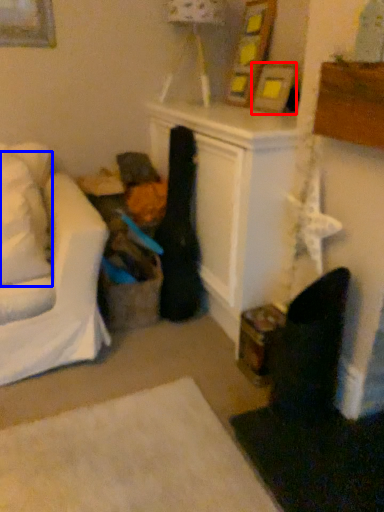
Question: Which object appears farthest to the camera in this image, picture frame (highlighted by a red box) or pillow (highlighted by a blue box)?

Choices:
 (A) picture frame
 (B) pillow

Answer: (A)